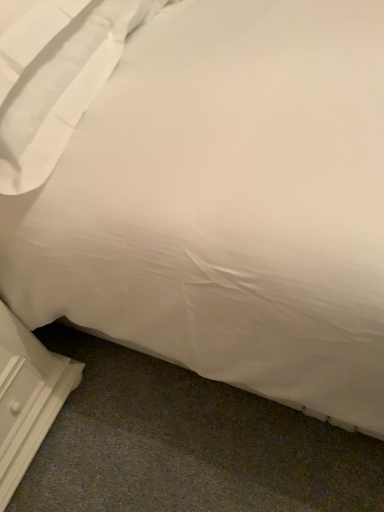
Where is `white wood dresser at lower left`? This screenshot has width=384, height=512. white wood dresser at lower left is located at coordinates (27, 397).

This screenshot has width=384, height=512. What do you see at coordinates (27, 397) in the screenshot?
I see `white wood dresser at lower left` at bounding box center [27, 397].

This screenshot has width=384, height=512. What do you see at coordinates (56, 79) in the screenshot?
I see `white smooth pillow at upper left` at bounding box center [56, 79].

This screenshot has height=512, width=384. Identify the location of white smooth pillow at upper left. (56, 79).

The height and width of the screenshot is (512, 384). Find the location of `white wood dresser at lower left`. white wood dresser at lower left is located at coordinates (27, 397).

Does white smooth pillow at upper left appear on the right side of white wood dresser at lower left?

Yes.

Is the depth of white smooth pillow at upper left less than that of white wood dresser at lower left?

That is True.

Does point (73, 42) lie behind point (73, 383)?

No.

From the image's perspective, is white smooth pillow at upper left below white wood dresser at lower left?

Incorrect, from the image's perspective, white smooth pillow at upper left is higher than white wood dresser at lower left.

From a real-world perspective, is white smooth pillow at upper left over white wood dresser at lower left?

Yes, from a real-world perspective, white smooth pillow at upper left is above white wood dresser at lower left.

Considering the sizes of objects white smooth pillow at upper left and white wood dresser at lower left in the image provided, who is wider, white smooth pillow at upper left or white wood dresser at lower left?

With larger width is white smooth pillow at upper left.

Between white smooth pillow at upper left and white wood dresser at lower left, which one has less height?

white smooth pillow at upper left.

Considering the relative sizes of white smooth pillow at upper left and white wood dresser at lower left in the image provided, is white smooth pillow at upper left smaller than white wood dresser at lower left?

Incorrect, white smooth pillow at upper left is not smaller in size than white wood dresser at lower left.

Which is correct: white smooth pillow at upper left is inside white wood dresser at lower left, or outside of it?

white smooth pillow at upper left is not enclosed by white wood dresser at lower left.

Is white smooth pillow at upper left placed right next to white wood dresser at lower left?

No, white smooth pillow at upper left is not next to white wood dresser at lower left.

Is white wood dresser at lower left at the back of white smooth pillow at upper left?

No.

How different are the orientations of white smooth pillow at upper left and white wood dresser at lower left in degrees?

The angular difference between white smooth pillow at upper left and white wood dresser at lower left is 2.55 degrees.

How much distance is there between white smooth pillow at upper left and white wood dresser at lower left?

white smooth pillow at upper left is 21.54 inches from white wood dresser at lower left.

This screenshot has width=384, height=512. In order to click on pillow that appears in front of the white wood dresser at lower left in this screenshot , I will do `click(56, 79)`.

Is white wood dresser at lower left to the left of white smooth pillow at upper left from the viewer's perspective?

Yes.

Consider the image. Is the position of white wood dresser at lower left more distant than that of white smooth pillow at upper left?

Yes, white wood dresser at lower left is further from the camera.

Is point (21, 323) in front of point (63, 72)?

No, (21, 323) is behind (63, 72).

From the image's perspective, is white wood dresser at lower left over white smooth pillow at upper left?

Actually, white wood dresser at lower left appears below white smooth pillow at upper left in the image.

From a real-world perspective, which object rests below the other?

From a 3D spatial view, white wood dresser at lower left is below.

Which of these two, white wood dresser at lower left or white smooth pillow at upper left, is thinner?

Thinner between the two is white wood dresser at lower left.

Considering the sizes of objects white wood dresser at lower left and white smooth pillow at upper left in the image provided, who is shorter, white wood dresser at lower left or white smooth pillow at upper left?

Standing shorter between the two is white smooth pillow at upper left.

Between white wood dresser at lower left and white smooth pillow at upper left, which one has smaller size?

white wood dresser at lower left is smaller.

Is white wood dresser at lower left inside the boundaries of white smooth pillow at upper left, or outside?

white wood dresser at lower left is not enclosed by white smooth pillow at upper left.

Is white wood dresser at lower left not close to white smooth pillow at upper left?

No, white wood dresser at lower left is not far away from white smooth pillow at upper left.

Could you tell me if white wood dresser at lower left is facing white smooth pillow at upper left?

No, white wood dresser at lower left is not turned towards white smooth pillow at upper left.

Can you tell me how much white wood dresser at lower left and white smooth pillow at upper left differ in facing direction?

2.55 degrees separate the facing orientations of white wood dresser at lower left and white smooth pillow at upper left.

Based on the photo, how distant is white wood dresser at lower left from white smooth pillow at upper left?

They are 54.72 centimeters apart.

Find the location of a particular element. This screenshot has height=512, width=384. dresser that is on the left side of white smooth pillow at upper left is located at coordinates (27, 397).

Where is `dresser on the left of the white smooth pillow at upper left`? Image resolution: width=384 pixels, height=512 pixels. dresser on the left of the white smooth pillow at upper left is located at coordinates (27, 397).

Identify the location of dresser below the white smooth pillow at upper left (from the image's perspective). The image size is (384, 512). (27, 397).